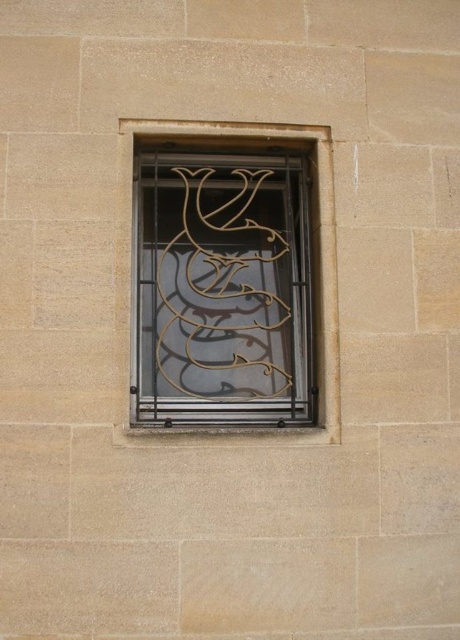
You are an interior designer assessing the window decor. You have two items to place in the center of the window frame. The gold wrought iron at center and the metallic wire at center. Which item will you choose if you want the smaller one to be placed there?

The gold wrought iron at center is smaller than the metallic wire at center, so you should choose the gold wrought iron at center to place in the center of the window frame.

You are an architect examining the window design. You notice two elements at the center of the window frame. Which one is placed above the other? The gold wrought iron at center or the metallic wire at center?

The gold wrought iron at center is positioned over metallic wire at center, so the gold wrought iron at center is above the metallic wire at center.